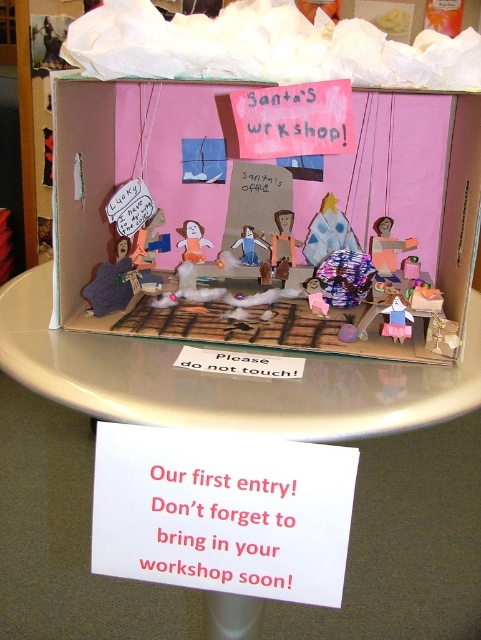
Question: Can you confirm if wooden figure at center is thinner than matte blue angel at center?

Choices:
 (A) no
 (B) yes

Answer: (B)

Question: Is pink paper sign at center positioned before wooden figure at center?

Choices:
 (A) no
 (B) yes

Answer: (B)

Question: Can you confirm if pink paper sign at center is positioned below matte orange plush monkey at center?

Choices:
 (A) yes
 (B) no

Answer: (B)

Question: Which object appears farthest from the camera in this image?

Choices:
 (A) matte pink fabric at center
 (B) pink fabric doll at center

Answer: (A)

Question: Which point is farther from the camera taking this photo?

Choices:
 (A) (330, 152)
 (B) (202, 244)

Answer: (B)

Question: Which object is the farthest from the wooden figure at center?

Choices:
 (A) pink fabric doll at center
 (B) matte blue angel at center

Answer: (A)